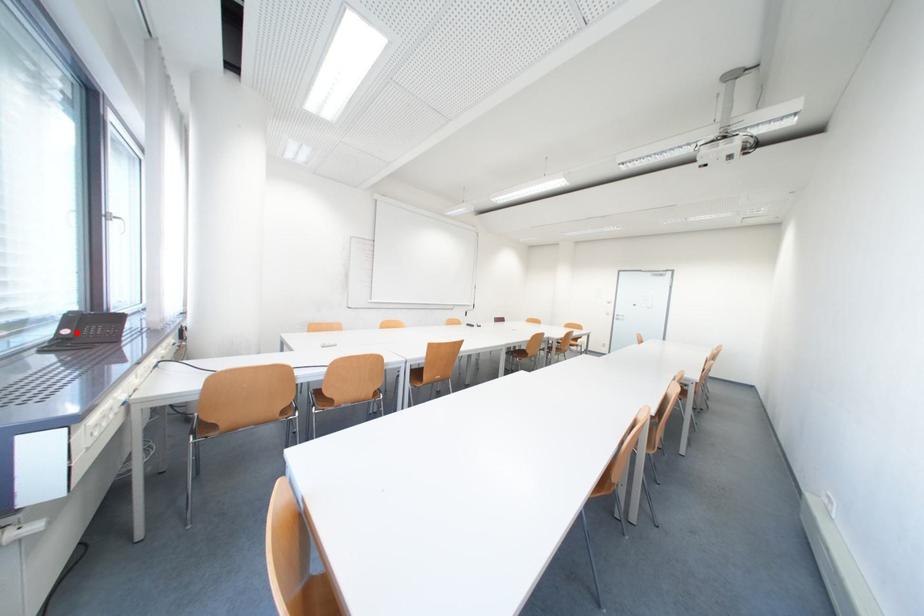
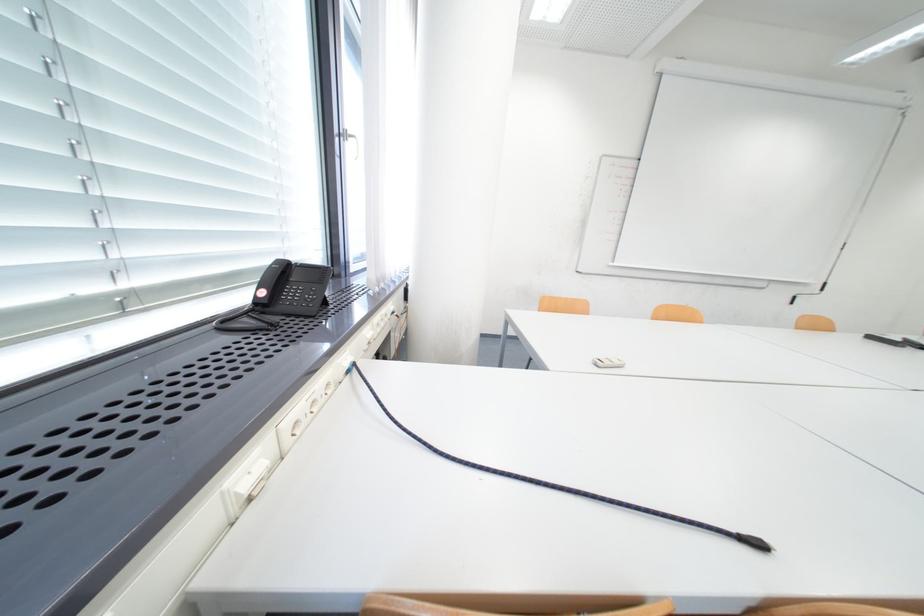
Locate, in the second image, the point that corresponds to the highlighted location in the first image.

(274, 294)